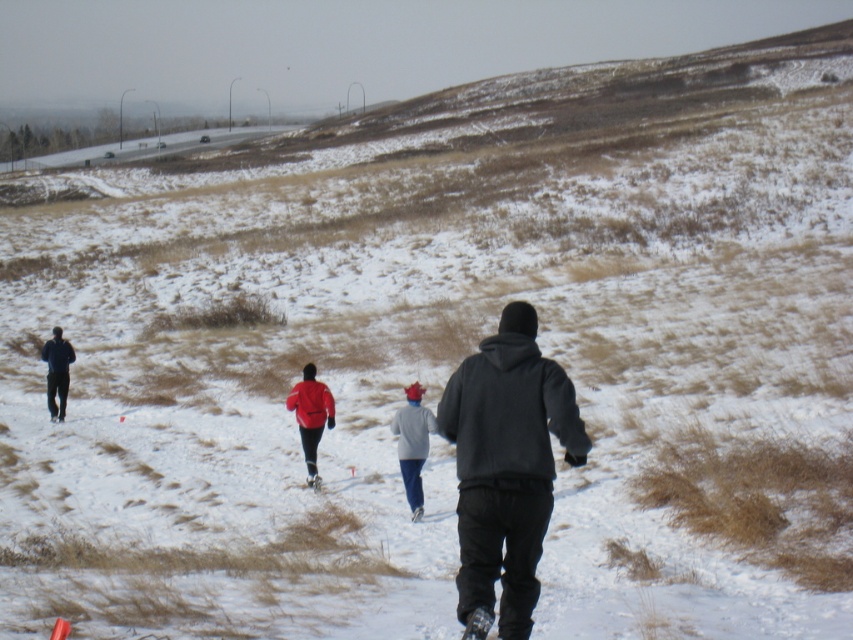
Question: Where is dark blue jacket at left located in relation to white matte ski at center in the image?

Choices:
 (A) below
 (B) above

Answer: (B)

Question: Which point is closer to the camera?

Choices:
 (A) (49, 372)
 (B) (311, 385)
 (C) (309, 477)
 (D) (407, 404)

Answer: (D)

Question: Which of the following is the closest to the observer?

Choices:
 (A) white matte ski at center
 (B) gray fleece jacket at center
 (C) matte red jacket at center
 (D) dark gray hoodie at center

Answer: (D)

Question: Does dark gray hoodie at center appear on the left side of matte red jacket at center?

Choices:
 (A) yes
 (B) no

Answer: (B)

Question: Among these points, which one is nearest to the camera?

Choices:
 (A) (309, 372)
 (B) (62, 369)

Answer: (A)

Question: Is gray fleece jacket at center to the right of dark blue jacket at left from the viewer's perspective?

Choices:
 (A) no
 (B) yes

Answer: (B)